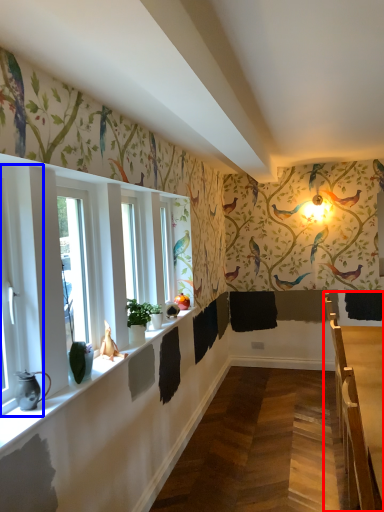
Question: Among these objects, which one is farthest to the camera, table (highlighted by a red box) or window (highlighted by a blue box)?

Choices:
 (A) table
 (B) window

Answer: (A)